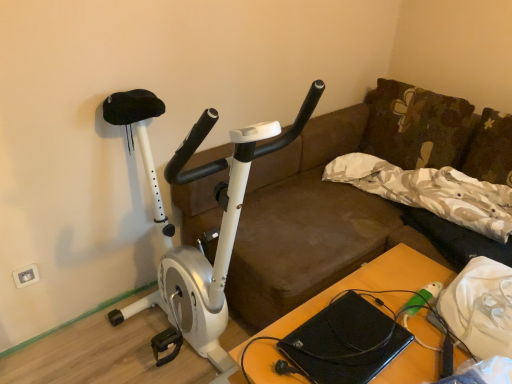
Question: From a real-world perspective, does white plastic electric outlet at lower left sit lower than beige floral fabric pillow at upper right, the first pillow positioned from the bottom?

Choices:
 (A) yes
 (B) no

Answer: (A)

Question: Is white plastic electric outlet at lower left oriented away from beige floral fabric pillow at upper right, the first pillow positioned from the bottom?

Choices:
 (A) no
 (B) yes

Answer: (A)

Question: Is white plastic electric outlet at lower left far away from beige floral fabric pillow at upper right, the first pillow positioned from the bottom?

Choices:
 (A) yes
 (B) no

Answer: (A)

Question: Is white plastic electric outlet at lower left not inside beige floral fabric pillow at upper right, placed as the 2th pillow when sorted from top to bottom?

Choices:
 (A) yes
 (B) no

Answer: (A)

Question: Does white plastic electric outlet at lower left lie behind beige floral fabric pillow at upper right, placed as the 2th pillow when sorted from top to bottom?

Choices:
 (A) yes
 (B) no

Answer: (A)

Question: Considering the positions of point (22, 266) and point (248, 347), is point (22, 266) closer or farther from the camera than point (248, 347)?

Choices:
 (A) farther
 (B) closer

Answer: (A)

Question: From the image's perspective, is white plastic electric outlet at lower left positioned above or below wooden table at center?

Choices:
 (A) above
 (B) below

Answer: (A)

Question: Relative to wooden table at center, is white plastic electric outlet at lower left in front or behind?

Choices:
 (A) front
 (B) behind

Answer: (B)

Question: From a real-world perspective, is white plastic electric outlet at lower left physically located above or below wooden table at center?

Choices:
 (A) below
 (B) above

Answer: (B)

Question: From a real-world perspective, is white matte stationary bicycle at left positioned above or below wooden table at center?

Choices:
 (A) above
 (B) below

Answer: (A)

Question: In the image, is white matte stationary bicycle at left on the left side or the right side of wooden table at center?

Choices:
 (A) left
 (B) right

Answer: (A)

Question: From their relative heights in the image, would you say white matte stationary bicycle at left is taller or shorter than wooden table at center?

Choices:
 (A) tall
 (B) short

Answer: (A)

Question: From the image's perspective, is white matte stationary bicycle at left above or below wooden table at center?

Choices:
 (A) below
 (B) above

Answer: (B)

Question: Relative to white matte stationary bicycle at left, is white plastic electric outlet at lower left in front or behind?

Choices:
 (A) behind
 (B) front

Answer: (A)

Question: Is white plastic electric outlet at lower left inside the boundaries of white matte stationary bicycle at left, or outside?

Choices:
 (A) inside
 (B) outside

Answer: (B)